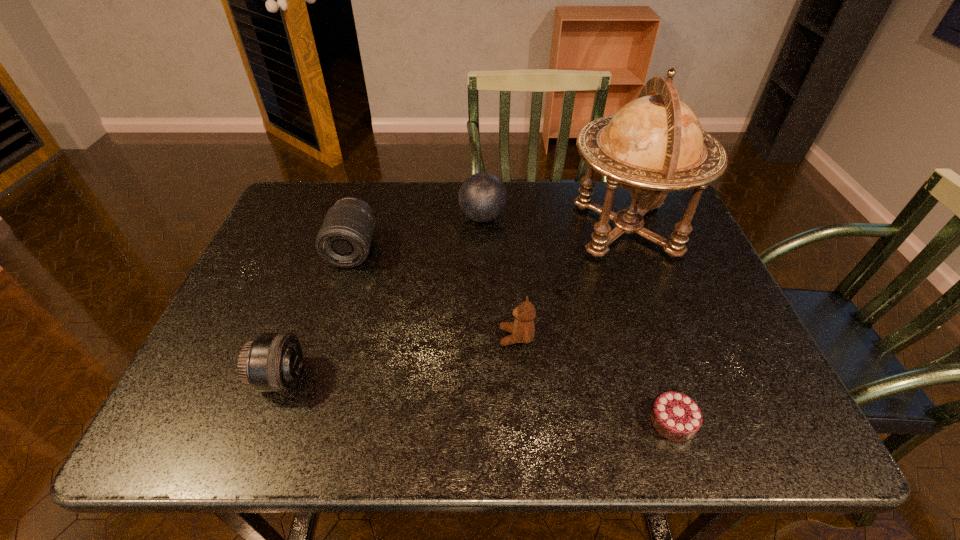
Where is `telephoto lens that is at the near edge`? Image resolution: width=960 pixels, height=540 pixels. telephoto lens that is at the near edge is located at coordinates (x=272, y=362).

Image resolution: width=960 pixels, height=540 pixels. What are the coordinates of `chocolate cake situated at the near edge` in the screenshot? It's located at (675, 416).

At what (x,y) coordinates should I click in order to perform the action: click on object at the left edge. Please return your answer as a coordinate pair (x, y). This screenshot has height=540, width=960. Looking at the image, I should click on (272, 362).

At what (x,y) coordinates should I click in order to perform the action: click on object that is at the right edge. Please return your answer as a coordinate pair (x, y). Looking at the image, I should click on (654, 144).

This screenshot has height=540, width=960. I want to click on object present at the near left corner, so click(272, 362).

Locate an element on the screen. The width and height of the screenshot is (960, 540). object that is at the far right corner is located at coordinates [x=654, y=144].

In the image, there is a desktop. At what (x,y) coordinates should I click in order to perform the action: click on vacant space at the far edge. Please return your answer as a coordinate pair (x, y). This screenshot has width=960, height=540. Looking at the image, I should click on (547, 191).

The width and height of the screenshot is (960, 540). I want to click on vacant space at the near edge of the desktop, so click(x=636, y=415).

Find the location of a particular element. free location at the left edge is located at coordinates (272, 316).

Locate an element on the screen. The width and height of the screenshot is (960, 540). vacant space at the right edge of the desktop is located at coordinates (704, 258).